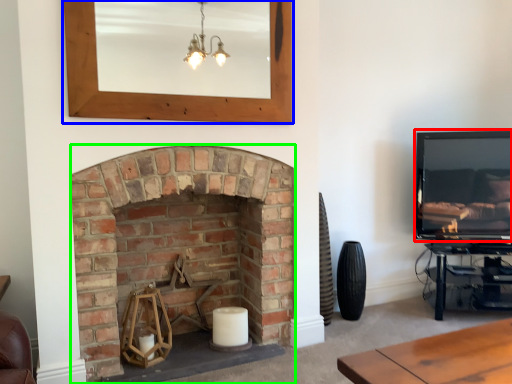
Question: Which object is the farthest from television (highlighted by a red box)? Choose among these: picture frame (highlighted by a blue box) or fireplace (highlighted by a green box).

Choices:
 (A) picture frame
 (B) fireplace

Answer: (B)